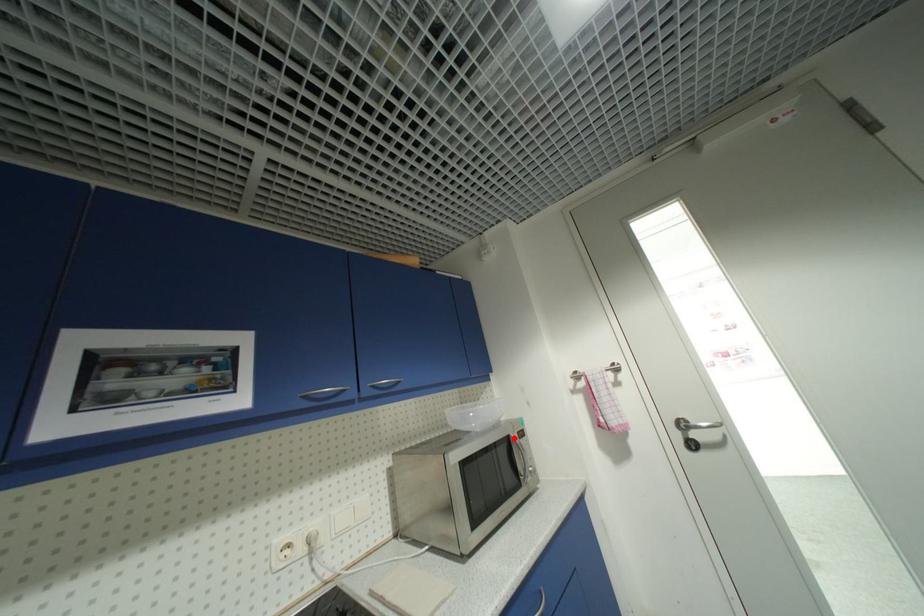
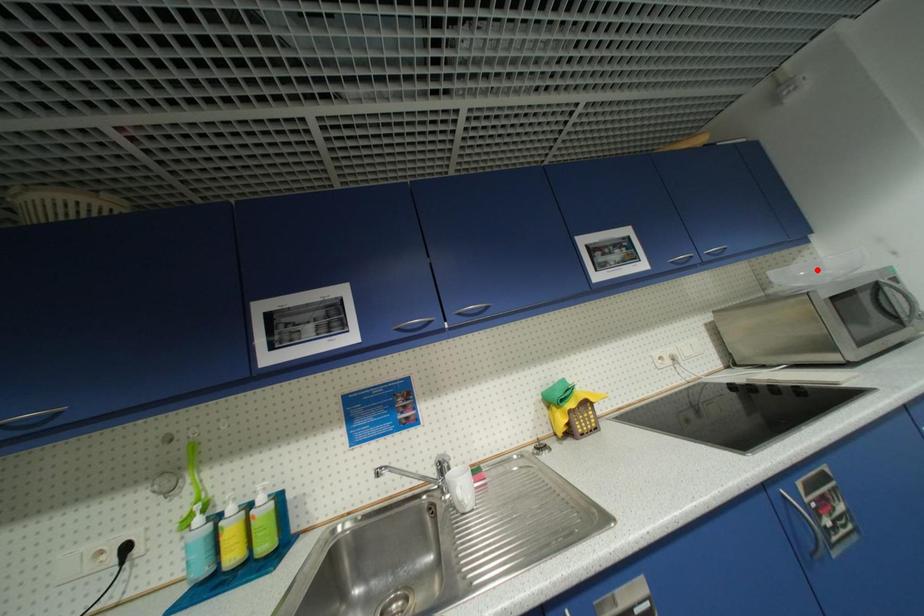
I am providing you with two images of the same scene from different viewpoints. A red point is marked on the first image and another point is marked on the second image. Is the red point in image1 aligned with the point shown in image2?

No